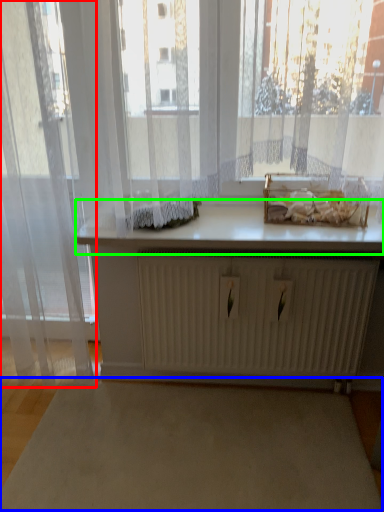
Question: Which object is the farthest from curtain (highlighted by a red box)? Choose among these: plain (highlighted by a blue box) or counter top (highlighted by a green box).

Choices:
 (A) plain
 (B) counter top

Answer: (A)